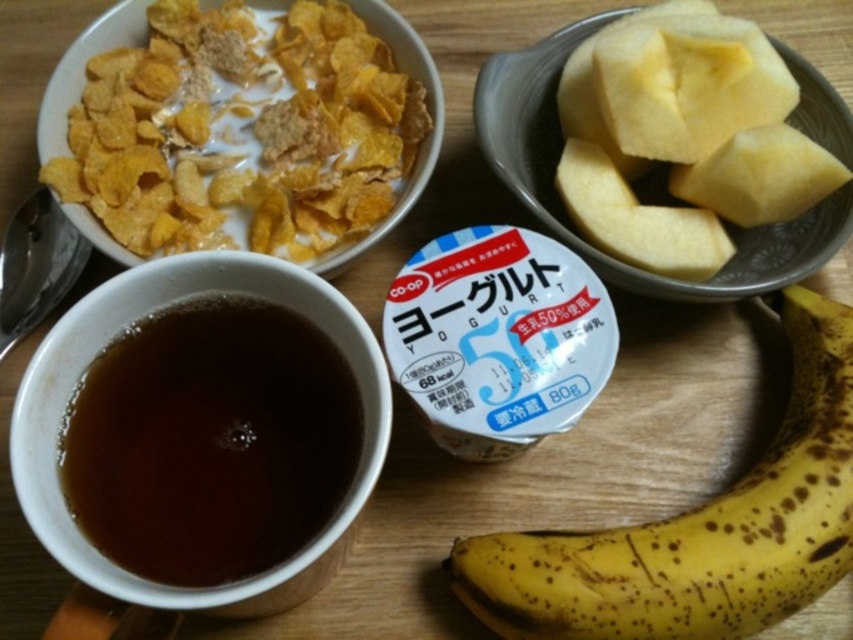
Is yellow matte corn flakes at upper left above brown matte cup at lower left?

Yes, yellow matte corn flakes at upper left is above brown matte cup at lower left.

Who is more distant from viewer, [94,64] or [273,563]?

Point [94,64]

Locate an element on the screen. yellow matte corn flakes at upper left is located at coordinates (241, 129).

Does yellow matte corn flakes at upper left appear on the left side of brown spotted banana at lower right?

Indeed, yellow matte corn flakes at upper left is positioned on the left side of brown spotted banana at lower right.

This screenshot has height=640, width=853. Identify the location of yellow matte corn flakes at upper left. (241, 129).

Which is more to the left, yellow matte corn flakes at upper left or yellow matte apple at upper right?

yellow matte corn flakes at upper left is more to the left.

Does yellow matte corn flakes at upper left have a greater width compared to yellow matte apple at upper right?

Yes, yellow matte corn flakes at upper left is wider than yellow matte apple at upper right.

Which is in front, point (323, 131) or point (792, 129)?

Point (792, 129) is in front.

Where is `yellow matte corn flakes at upper left`? The image size is (853, 640). yellow matte corn flakes at upper left is located at coordinates (241, 129).